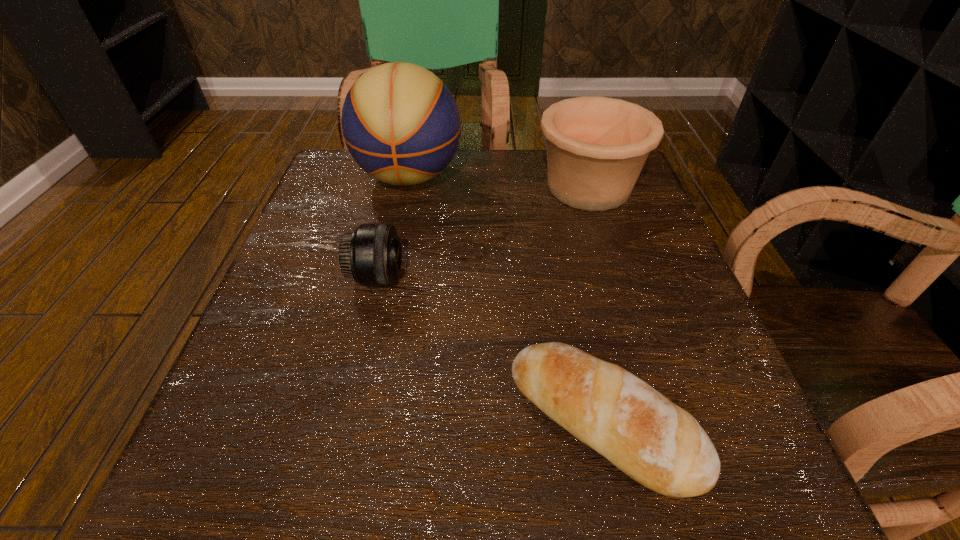
Identify the location of the tallest object. This screenshot has height=540, width=960. (401, 124).

The width and height of the screenshot is (960, 540). I want to click on pottery, so click(x=596, y=146).

This screenshot has height=540, width=960. Identify the location of telephoto lens. (371, 254).

This screenshot has height=540, width=960. Identify the location of the second shortest object. (371, 254).

Find the location of a particular element. The width and height of the screenshot is (960, 540). bread is located at coordinates (658, 444).

Identify the location of the shortest object. Image resolution: width=960 pixels, height=540 pixels. (658, 444).

You are a GUI agent. You are given a task and a screenshot of the screen. Output one action in this format:
    pyautogui.click(x=<x>, y=<y>)
    Task: Click on the free spot located 0.050m on the patterned surface of the basketball
    
    Given the screenshot: What is the action you would take?
    click(x=399, y=224)

Identify the location of free space located on the front of the pottery. (618, 283).

Where is `free location located on the front-facing side of the second nearest object`? free location located on the front-facing side of the second nearest object is located at coordinates (481, 278).

Find the location of a particular element. free region located 0.310m on the left of the shortest object is located at coordinates (283, 420).